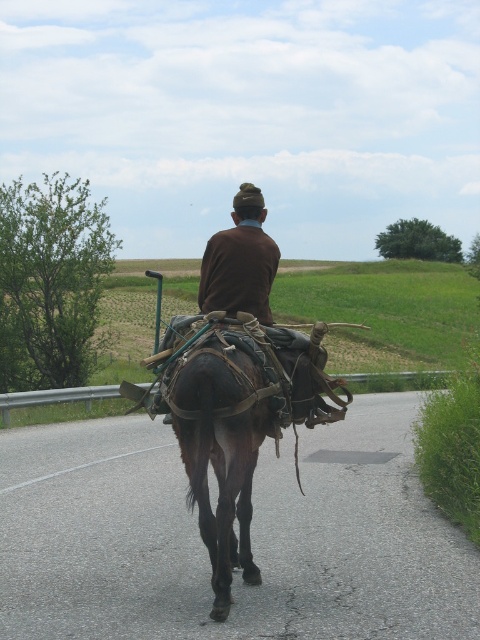
From the picture: You are standing at the starting point of the rural path and want to reach the asphalt road at center. Which direction should you walk to get there?

The asphalt road at center is located at point [252,536], so you should walk towards that coordinate to reach it.

You are a delivery drone flying above the rural scene. You need to land on the asphalt road at center to drop off a package. Is the point at coordinates (x=252, y=536) on the asphalt road at center a suitable landing spot?

The point at coordinates (x=252, y=536) is on the asphalt road at center, so yes, it is a suitable landing spot for the delivery drone to drop off the package.

You are a cyclist approaching a rural road. You see an asphalt road at center and a brown leather horse at center. Which object is positioned to the right from your perspective?

The asphalt road at center is to the right of the brown leather horse at center, so the asphalt road at center is positioned to the right from your perspective.